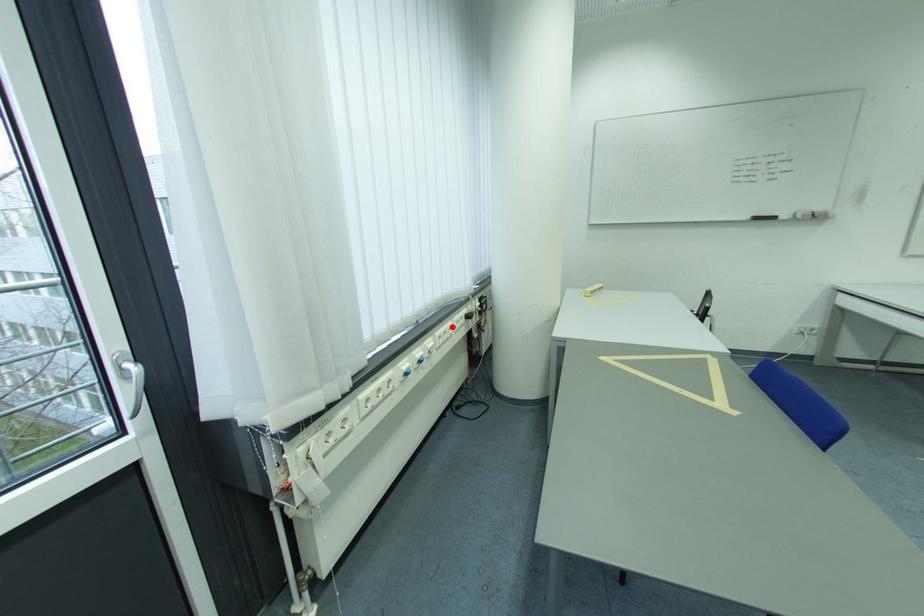
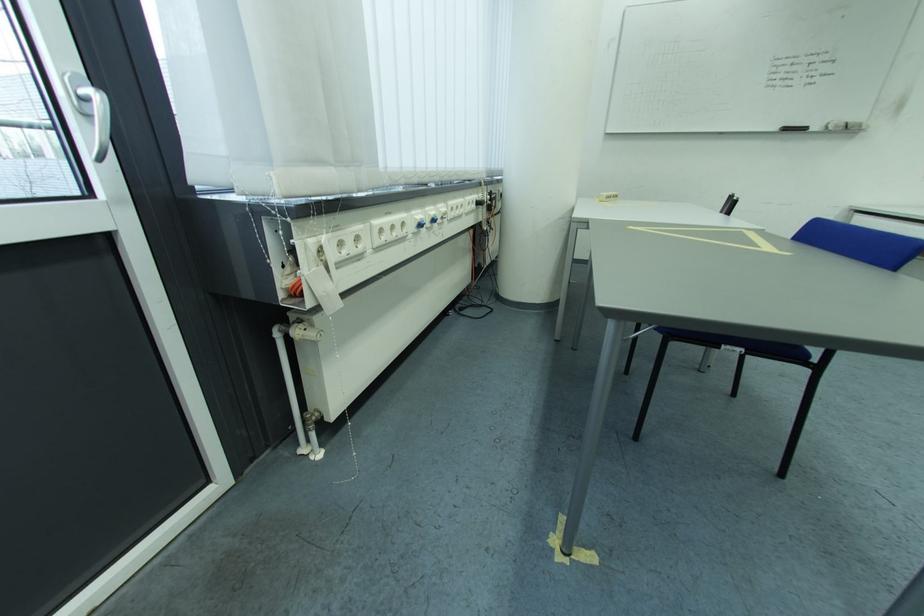
Question: I am providing you with two images of the same scene from different viewpoints. A red point is marked on the first image. At the location where the point appears in image 1, is it still visible in image 2?

Choices:
 (A) Yes
 (B) No

Answer: (A)